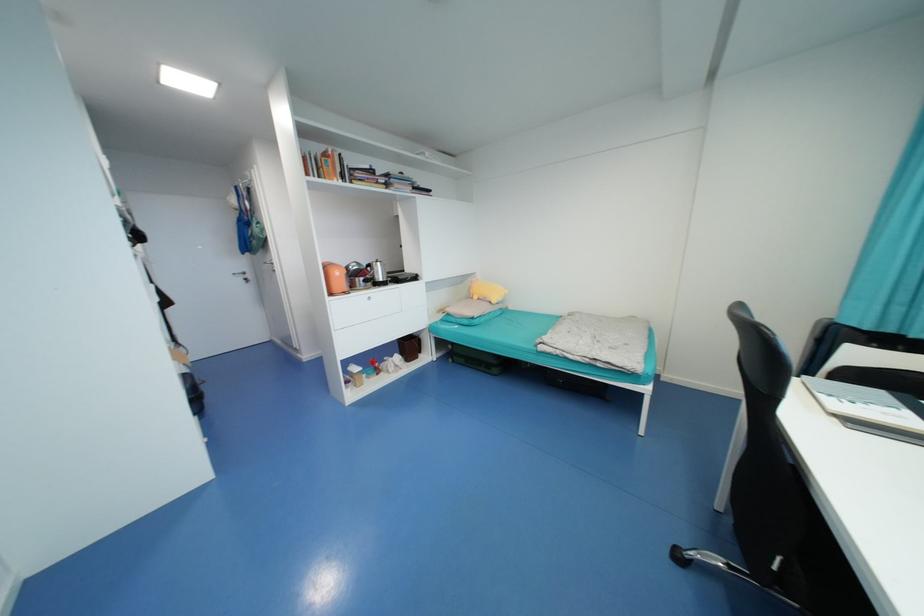
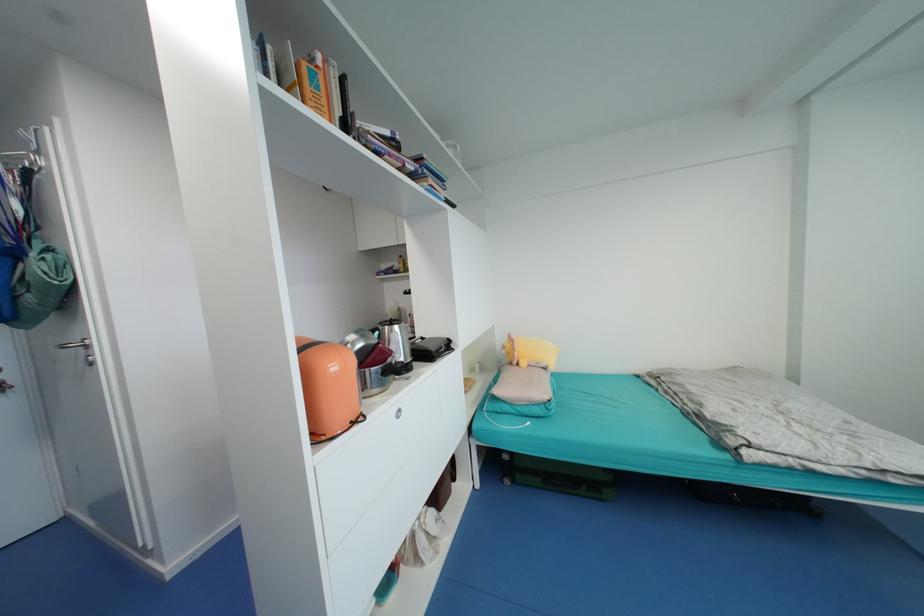
Where in the second image is the point corresponding to [331,161] from the first image?

(317, 76)